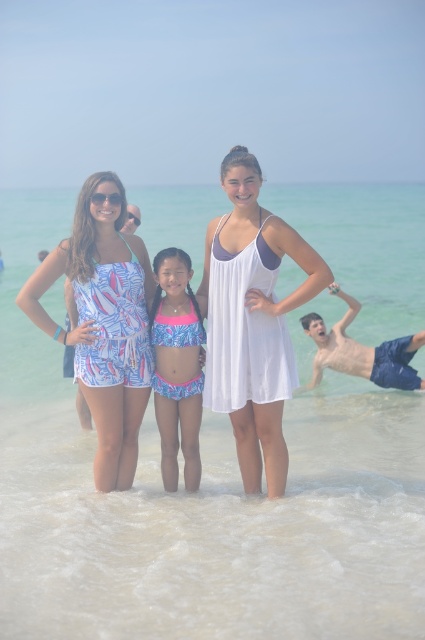
Question: Based on their relative distances, which object is farther from the white sheer dress at center?

Choices:
 (A) printed fabric romper at left
 (B) pink lycra bikini at center
 (C) clear water at center

Answer: (C)

Question: Can you confirm if white sheer dress at center is bigger than printed fabric romper at left?

Choices:
 (A) no
 (B) yes

Answer: (B)

Question: Considering the relative positions of clear water at center and pink lycra bikini at center in the image provided, where is clear water at center located with respect to pink lycra bikini at center?

Choices:
 (A) left
 (B) right

Answer: (B)

Question: Does clear water at center appear on the left side of blue denim shorts at lower right?

Choices:
 (A) no
 (B) yes

Answer: (B)

Question: Which of the following is the closest to the observer?

Choices:
 (A) blue denim shorts at lower right
 (B) clear water at center
 (C) white sheer dress at center
 (D) pink lycra bikini at center

Answer: (B)

Question: Which point is closer to the camera taking this photo?

Choices:
 (A) (198, 420)
 (B) (246, 400)

Answer: (B)